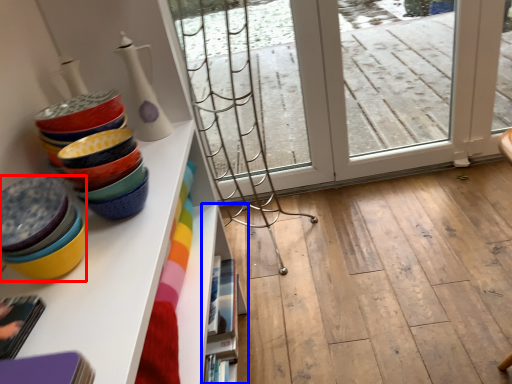
Question: Which object is closer to the camera taking this photo, table (highlighted by a red box) or shelf (highlighted by a blue box)?

Choices:
 (A) table
 (B) shelf

Answer: (A)